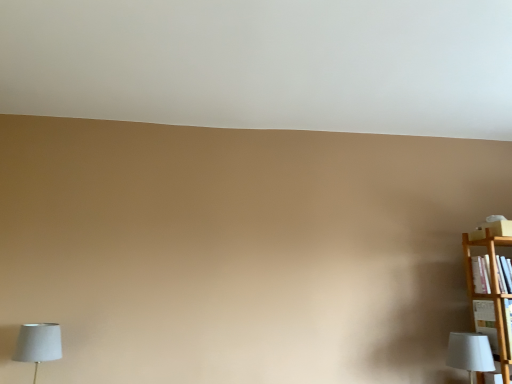
Question: Is wooden bookshelf at right thinner than white fabric lampshade at lower right, the first lamp viewed from the right?

Choices:
 (A) yes
 (B) no

Answer: (A)

Question: Considering the relative sizes of wooden bookshelf at right and white fabric lampshade at lower right, the second lamp positioned from the left, in the image provided, is wooden bookshelf at right bigger than white fabric lampshade at lower right, the second lamp positioned from the left,?

Choices:
 (A) yes
 (B) no

Answer: (B)

Question: Is wooden bookshelf at right to the left of white fabric lampshade at lower right, the second lamp positioned from the left, from the viewer's perspective?

Choices:
 (A) no
 (B) yes

Answer: (A)

Question: Does wooden bookshelf at right have a smaller size compared to white fabric lampshade at lower right, the first lamp viewed from the right?

Choices:
 (A) yes
 (B) no

Answer: (A)

Question: From the image's perspective, would you say wooden bookshelf at right is positioned over white fabric lampshade at lower right, the second lamp positioned from the left?

Choices:
 (A) no
 (B) yes

Answer: (B)

Question: Based on their sizes in the image, would you say white fabric lampshade at lower left, the first lamp when ordered from left to right, is bigger or smaller than wooden bookshelf at right?

Choices:
 (A) big
 (B) small

Answer: (A)

Question: Is white fabric lampshade at lower left, positioned as the 2th lamp in right-to-left order, inside or outside of wooden bookshelf at right?

Choices:
 (A) inside
 (B) outside

Answer: (B)

Question: From a real-world perspective, is white fabric lampshade at lower left, positioned as the 2th lamp in right-to-left order, positioned above or below wooden bookshelf at right?

Choices:
 (A) below
 (B) above

Answer: (A)

Question: In the image, is white fabric lampshade at lower left, positioned as the 2th lamp in right-to-left order, on the left side or the right side of wooden bookshelf at right?

Choices:
 (A) right
 (B) left

Answer: (B)

Question: Based on their sizes in the image, would you say white fabric lampshade at lower right, the first lamp viewed from the right, is bigger or smaller than wooden bookshelf at right?

Choices:
 (A) small
 (B) big

Answer: (B)

Question: Do you think white fabric lampshade at lower right, the first lamp viewed from the right, is within wooden bookshelf at right, or outside of it?

Choices:
 (A) inside
 (B) outside

Answer: (B)

Question: Visually, is white fabric lampshade at lower right, the second lamp positioned from the left, positioned to the left or to the right of wooden bookshelf at right?

Choices:
 (A) left
 (B) right

Answer: (A)

Question: Relative to wooden bookshelf at right, is white fabric lampshade at lower right, the first lamp viewed from the right, in front or behind?

Choices:
 (A) front
 (B) behind

Answer: (A)

Question: Considering the positions of point (25, 337) and point (481, 354), is point (25, 337) closer or farther from the camera than point (481, 354)?

Choices:
 (A) closer
 (B) farther

Answer: (B)

Question: Would you say white fabric lampshade at lower left, positioned as the 2th lamp in right-to-left order, is to the left or to the right of white fabric lampshade at lower right, the first lamp viewed from the right, in the picture?

Choices:
 (A) left
 (B) right

Answer: (A)